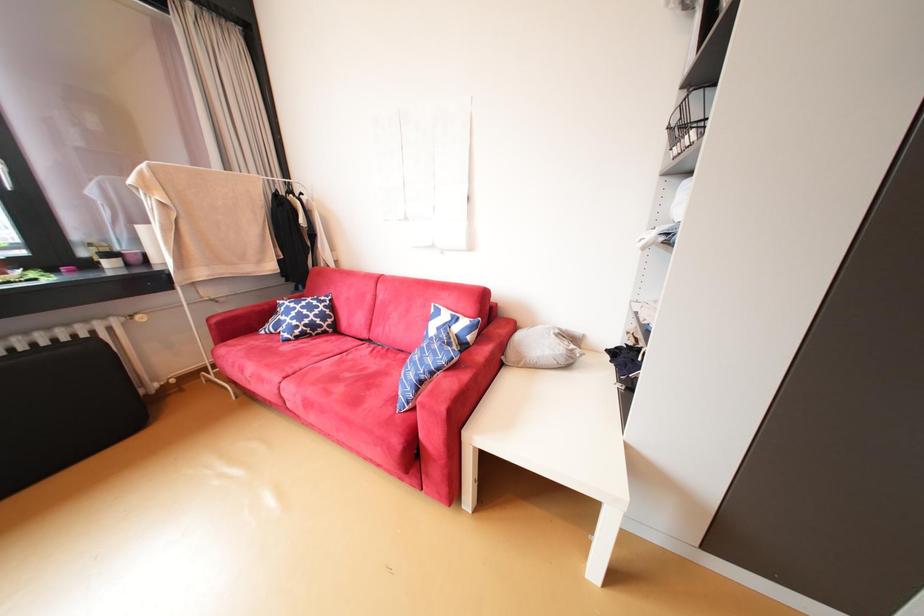
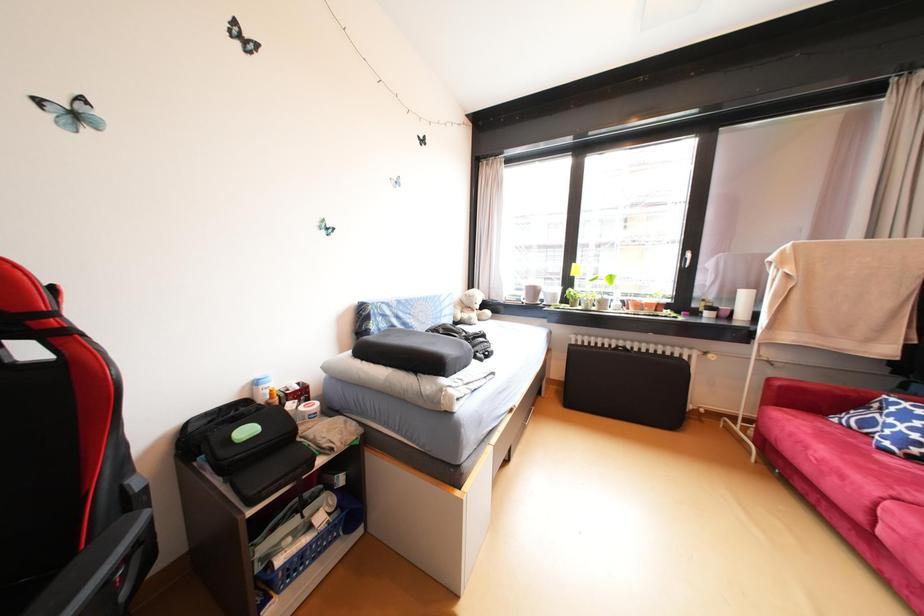
Question: The camera is either moving clockwise (left) or counter-clockwise (right) around the object. The first image is from the beginning of the video and the second image is from the end. Is the camera moving left or right when shooting the video?

Choices:
 (A) Left
 (B) Right

Answer: (B)